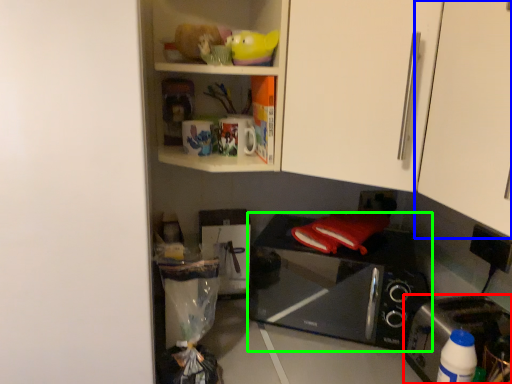
Question: Which is farther away from toaster (highlighted by a red box)? cabinetry (highlighted by a blue box) or microwave oven (highlighted by a green box)?

Choices:
 (A) cabinetry
 (B) microwave oven

Answer: (A)